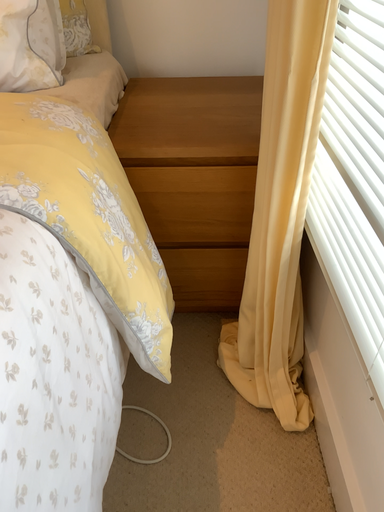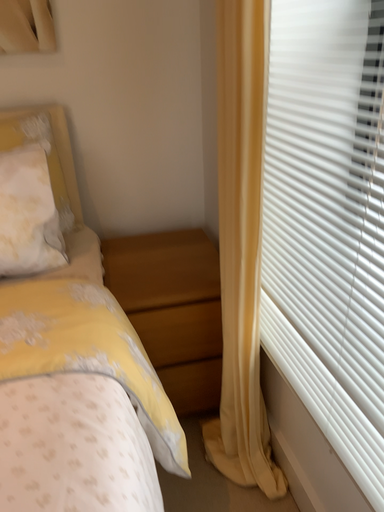
Question: How did the camera likely rotate when shooting the video?

Choices:
 (A) rotated right
 (B) rotated left

Answer: (A)